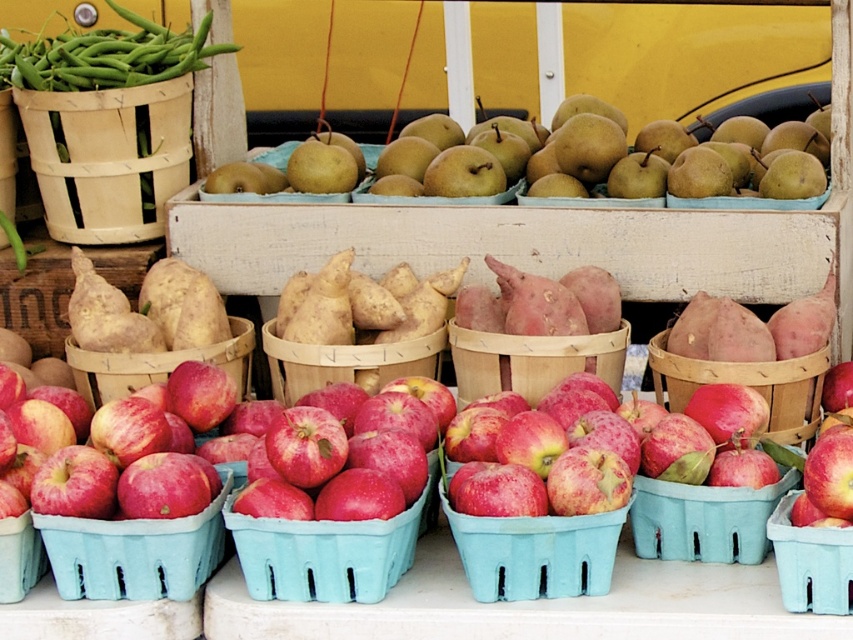
Between matte brown pears at center and matte plastic apples at center, which one has less height?

Standing shorter between the two is matte plastic apples at center.

Who is lower down, matte brown pears at center or matte plastic apples at center?

Positioned lower is matte plastic apples at center.

Is point (643, 180) farther from camera compared to point (375, 593)?

Yes, point (643, 180) is behind point (375, 593).

Image resolution: width=853 pixels, height=640 pixels. I want to click on matte brown pears at center, so click(613, 161).

Describe the element at coordinates (747, 385) in the screenshot. I see `natural brown basket at center` at that location.

Is point (665, 353) in front of point (143, 385)?

Yes, it is.

What do you see at coordinates (747, 385) in the screenshot? This screenshot has height=640, width=853. I see `natural brown basket at center` at bounding box center [747, 385].

The image size is (853, 640). I want to click on natural brown basket at center, so click(x=747, y=385).

How much distance is there between green matte beans at upper left and matte plastic basket at center?

green matte beans at upper left and matte plastic basket at center are 2.44 meters apart from each other.

Consider the image. Is green matte beans at upper left taller than matte plastic basket at center?

Yes, green matte beans at upper left is taller than matte plastic basket at center.

Between point (125, 68) and point (773, 483), which one is positioned in front?

Point (773, 483) is in front.

Image resolution: width=853 pixels, height=640 pixels. In order to click on green matte beans at upper left in this screenshot , I will do `click(108, 54)`.